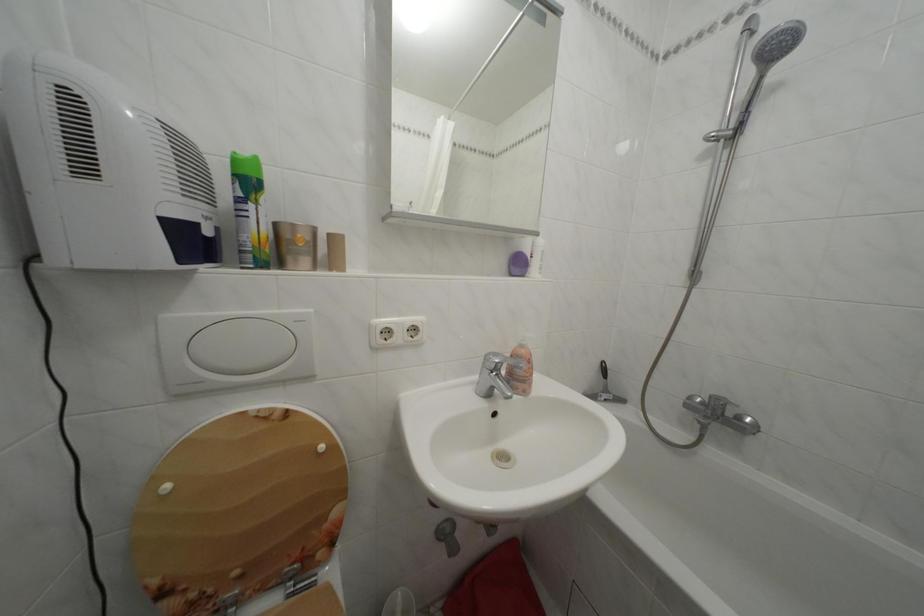
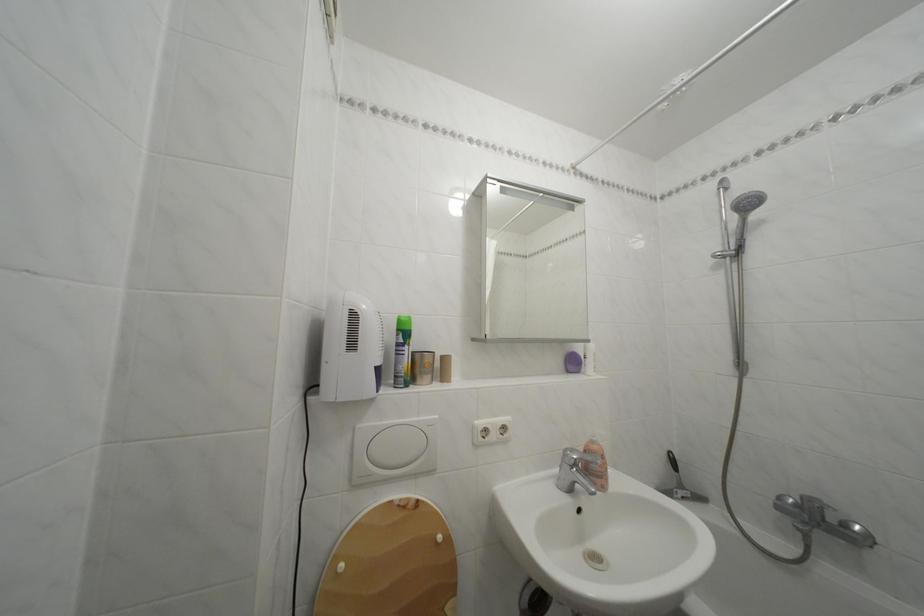
The point at (242, 182) is marked in the first image. Where is the corresponding point in the second image?

(407, 336)